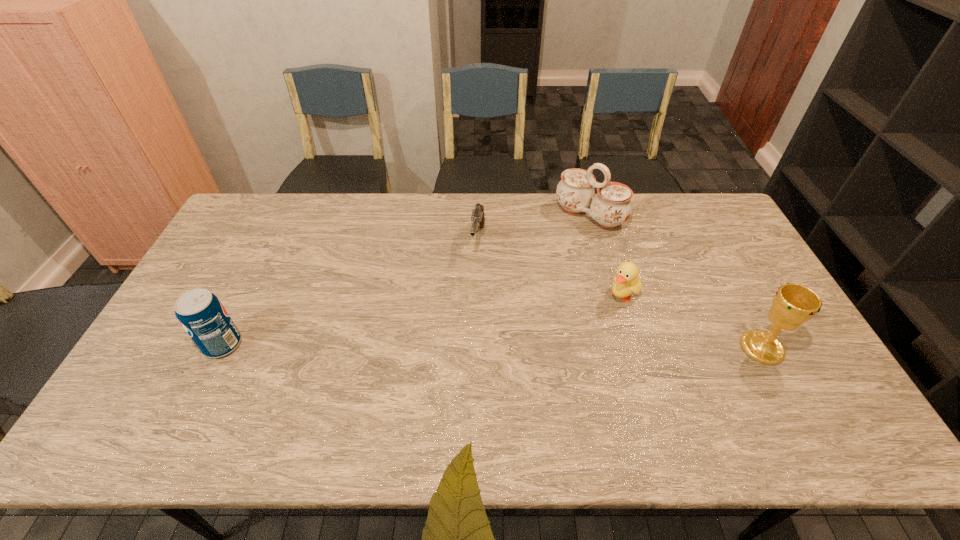
The image size is (960, 540). I want to click on object that is at the right edge, so click(x=793, y=304).

Locate an element on the screen. Image resolution: width=960 pixels, height=540 pixels. vacant space at the far edge of the desktop is located at coordinates (657, 217).

You are a GUI agent. You are given a task and a screenshot of the screen. Output one action in this format:
    pyautogui.click(x=<x>, y=<y>)
    Task: Click on the vacant area at the near edge
    The height and width of the screenshot is (540, 960).
    Given the screenshot: What is the action you would take?
    pyautogui.click(x=420, y=390)

You are a GUI agent. You are given a task and a screenshot of the screen. Output one action in this format:
    pyautogui.click(x=<x>, y=<y>)
    Task: Click on the vacant space at the right edge
    
    Given the screenshot: What is the action you would take?
    pyautogui.click(x=789, y=362)

What are the coordinates of `free point at the far right corner` in the screenshot? It's located at (703, 213).

This screenshot has width=960, height=540. I want to click on free space at the near right corner of the desktop, so tap(807, 393).

Find the location of a particular element. free space between the chinaware and the pistol is located at coordinates (534, 228).

Where is `vacant region between the rightmost object and the pop`? The image size is (960, 540). vacant region between the rightmost object and the pop is located at coordinates (492, 346).

What are the coordinates of `empty space that is in between the pop and the chinaware` in the screenshot? It's located at (406, 280).

Find the location of `free space between the pistol and the chinaware`. free space between the pistol and the chinaware is located at coordinates (534, 228).